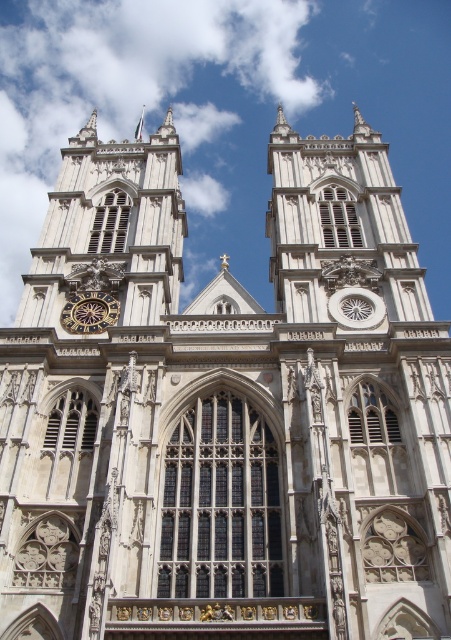
Question: Which object appears closest to the camera in this image?

Choices:
 (A) white stone clock tower at upper left
 (B) goldmetallicclock at lower center
 (C) white fluffy cloud at upper center

Answer: (A)

Question: Can you confirm if white stone clock tower at upper left is bigger than goldmetallicclock at lower center?

Choices:
 (A) no
 (B) yes

Answer: (B)

Question: Among these objects, which one is farthest from the camera?

Choices:
 (A) white stone clock tower at upper left
 (B) white fluffy cloud at upper center
 (C) goldmetallicclock at lower center

Answer: (B)

Question: Among these points, which one is nearest to the camera?

Choices:
 (A) (115, 301)
 (B) (92, 298)

Answer: (A)

Question: Is white fluffy cloud at upper center wider than goldmetallicclock at lower center?

Choices:
 (A) yes
 (B) no

Answer: (A)

Question: Is white stone clock tower at upper left in front of goldmetallicclock at lower center?

Choices:
 (A) no
 (B) yes

Answer: (B)